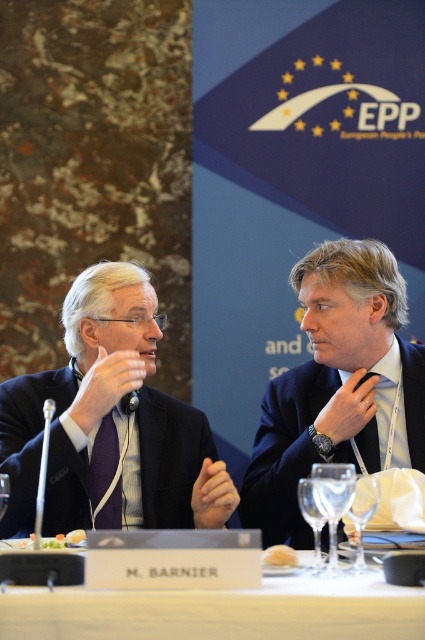
You are a server at the event and need to place both the clear glass wine glass at lower center and the silver metallic microphone at left on a tray. Which object should you pick up first to ensure stability?

The clear glass wine glass at lower center has a smaller size compared to the silver metallic microphone at left, so you should pick up the silver metallic microphone at left first to ensure stability.

You are a photographer positioned at the origin point of the coordinate system. You need to capture a photo of the white glossy table at center. What are the coordinates of the table?

The coordinates of the white glossy table at center are at point (x=221, y=611).